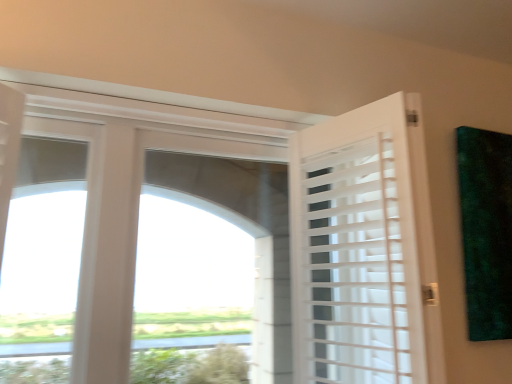
Measure the distance between white matte door at right and camera.

They are 3.33 feet apart.

Describe the element at coordinates (362, 248) in the screenshot. This screenshot has height=384, width=512. I see `white matte door at right` at that location.

Measure the distance between point [429,257] and camera.

Point [429,257] and camera are 3.55 feet apart.

Locate an element on the screen. white matte door at right is located at coordinates (362, 248).

This screenshot has height=384, width=512. Describe the element at coordinates (486, 230) in the screenshot. I see `green matte painting at upper right` at that location.

At what (x,y) coordinates should I click in order to perform the action: click on green matte painting at upper right. Please return your answer as a coordinate pair (x, y). Looking at the image, I should click on (486, 230).

I want to click on white matte door at right, so click(362, 248).

Can you confirm if white matte door at right is positioned to the left of green matte painting at upper right?

Correct, you'll find white matte door at right to the left of green matte painting at upper right.

Is white matte door at right further to camera compared to green matte painting at upper right?

That is False.

Considering the positions of points (352, 181) and (492, 335), is point (352, 181) farther from camera compared to point (492, 335)?

That is False.

From the image's perspective, would you say white matte door at right is shown under green matte painting at upper right?

Indeed, from the image's perspective, white matte door at right is shown beneath green matte painting at upper right.

From a real-world perspective, is white matte door at right above or below green matte painting at upper right?

white matte door at right is below green matte painting at upper right.

Considering the sizes of objects white matte door at right and green matte painting at upper right in the image provided, who is thinner, white matte door at right or green matte painting at upper right?

green matte painting at upper right is thinner.

Considering the sizes of white matte door at right and green matte painting at upper right in the image, is white matte door at right taller or shorter than green matte painting at upper right?

white matte door at right is taller than green matte painting at upper right.

Is white matte door at right bigger or smaller than green matte painting at upper right?

Considering their sizes, white matte door at right takes up more space than green matte painting at upper right.

Is white matte door at right not inside green matte painting at upper right?

white matte door at right lies outside green matte painting at upper right's area.

Is white matte door at right positioned far away from green matte painting at upper right?

No, there isn't a large distance between white matte door at right and green matte painting at upper right.

Could you tell me if white matte door at right is facing green matte painting at upper right?

No, white matte door at right is not facing towards green matte painting at upper right.

How many degrees apart are the facing directions of white matte door at right and green matte painting at upper right?

The facing directions of white matte door at right and green matte painting at upper right are 73.5 degrees apart.

Locate an element on the screen. The height and width of the screenshot is (384, 512). window screen that appears on the right of white matte door at right is located at coordinates (486, 230).

Based on the photo, between green matte painting at upper right and white matte door at right, which one appears on the left side from the viewer's perspective?

Positioned to the left is white matte door at right.

Based on the photo, is green matte painting at upper right closer to the viewer compared to white matte door at right?

No, green matte painting at upper right is further to the viewer.

Considering the positions of points (480, 143) and (422, 162), is point (480, 143) closer to camera compared to point (422, 162)?

No, (480, 143) is behind (422, 162).

From the image's perspective, is green matte painting at upper right beneath white matte door at right?

No.

From a real-world perspective, between green matte painting at upper right and white matte door at right, who is vertically lower?

white matte door at right is physically lower.

Considering the sizes of green matte painting at upper right and white matte door at right in the image, is green matte painting at upper right wider or thinner than white matte door at right?

Considering their sizes, green matte painting at upper right looks slimmer than white matte door at right.

Does green matte painting at upper right have a greater height compared to white matte door at right?

No, green matte painting at upper right is not taller than white matte door at right.

Considering the sizes of green matte painting at upper right and white matte door at right in the image, is green matte painting at upper right bigger or smaller than white matte door at right?

In the image, green matte painting at upper right appears to be smaller than white matte door at right.

Is green matte painting at upper right located outside white matte door at right?

green matte painting at upper right is positioned outside white matte door at right.

Is green matte painting at upper right placed right next to white matte door at right?

green matte painting at upper right and white matte door at right are clearly separated.

Is green matte painting at upper right oriented towards white matte door at right?

No, green matte painting at upper right does not turn towards white matte door at right.

The height and width of the screenshot is (384, 512). Identify the location of window screen above the white matte door at right (from the image's perspective). (486, 230).

Image resolution: width=512 pixels, height=384 pixels. Find the location of `door to the left of green matte painting at upper right`. door to the left of green matte painting at upper right is located at coordinates (362, 248).

This screenshot has height=384, width=512. In the image, there is a white matte door at right. What are the coordinates of `window screen above it (from the image's perspective)` in the screenshot? It's located at (486, 230).